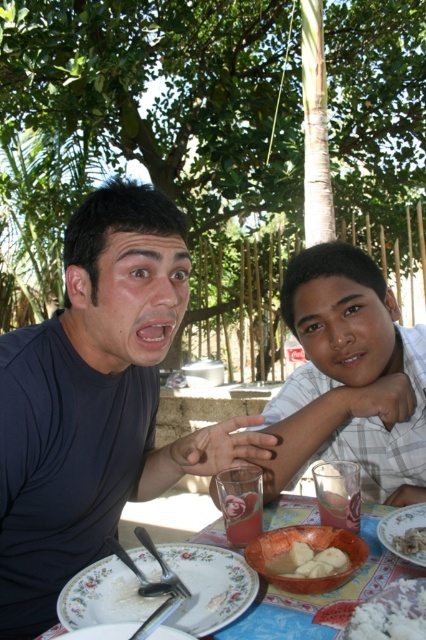
You are standing at the point labeled as point [417,508] and want to walk towards the point labeled as point [184,576]. According to the image, will you be moving forward or backward?

Since point [184,576] is in front of point [417,508], moving towards it would mean you are moving forward.

You are a chef preparing a meal and need to choose between the smooth clay bowl at center and the white creamy rice at lower right to serve a main course. Which object would you select and why?

The smooth clay bowl at center is larger in size than the white creamy rice at lower right, so the chef should choose the smooth clay bowl at center to serve the main course as it can accommodate the portion better.

What is the object located at the coordinates point (321, 593)?

The object located at point (321, 593) is the blue fabric tablecloth at lower center.